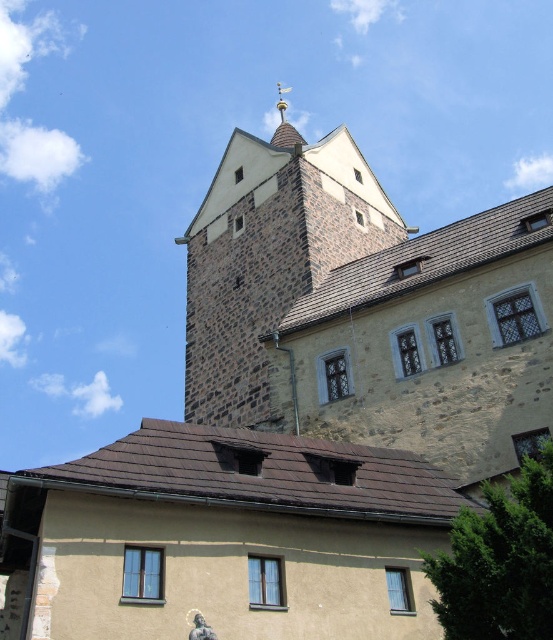
You are an architect inspecting the historic stone building. You notice the rustic stone tower at upper center and the gold spire at upper center. Which structure is taller?

The gold spire at upper center is taller than the rustic stone tower at upper center.

You are standing in front of the historic stone building and want to determine the relative positions of two points marked on the structure. Which of the two points, point (x=232, y=340) or point (x=279, y=106), is closer to you?

Point (x=232, y=340) is closer to the viewer than point (x=279, y=106).